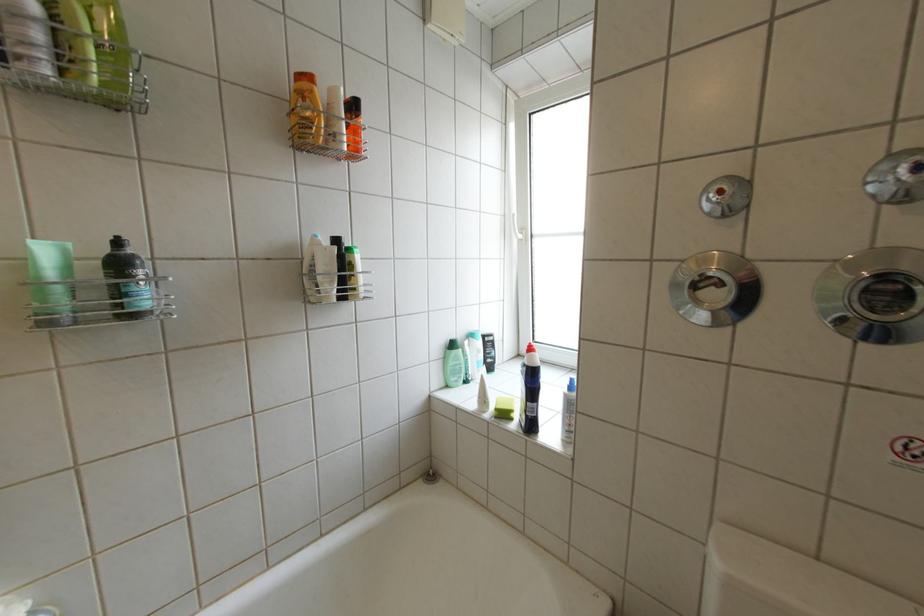
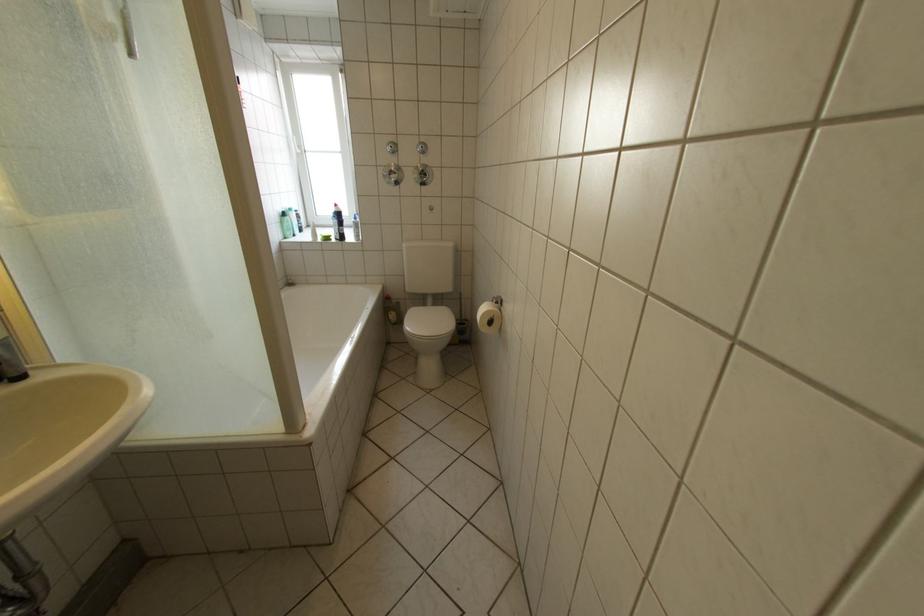
Where in the second image is the point corresponding to (525,416) from the first image?

(344, 238)